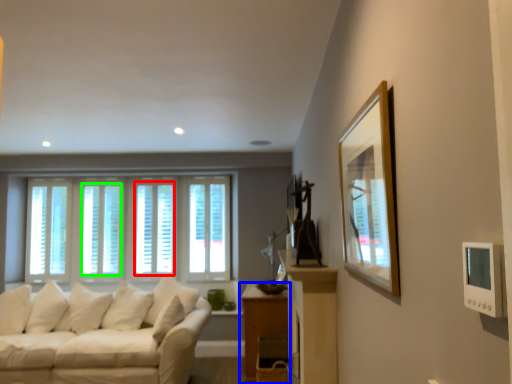
Question: Which object is positioned farthest from window (highlighted by a red box)? Select from table (highlighted by a blue box) and window (highlighted by a green box).

Choices:
 (A) table
 (B) window

Answer: (A)